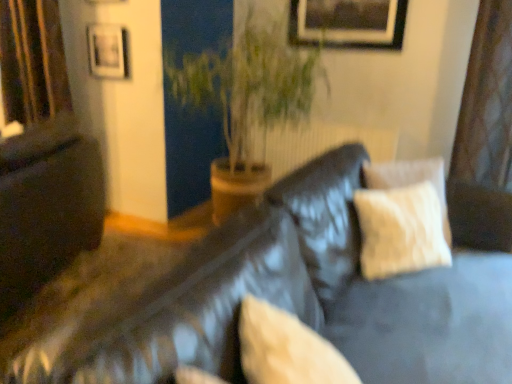
Question: Is silky brown curtain at left in front of or behind beige fabric pillow at center in the image?

Choices:
 (A) behind
 (B) front

Answer: (A)

Question: Is point (44, 21) positioned closer to the camera than point (281, 382)?

Choices:
 (A) closer
 (B) farther

Answer: (B)

Question: Estimate the real-world distances between objects in this image. Which object is closer to the matte black picture frame at upper left, which is the first picture frame in left-to-right order?

Choices:
 (A) green leafy plant at center
 (B) silky brown curtain at left
 (C) beige fabric pillow at center
 (D) leather couch at center
 (E) wooden picture frame at upper center, the 1th picture frame when ordered from right to left

Answer: (B)

Question: Which object is the farthest from the leather couch at center?

Choices:
 (A) matte black couch at left
 (B) green leafy plant at center
 (C) beige fabric pillow at center
 (D) matte black picture frame at upper left, which is the first picture frame in left-to-right order
 (E) silky brown curtain at left

Answer: (E)